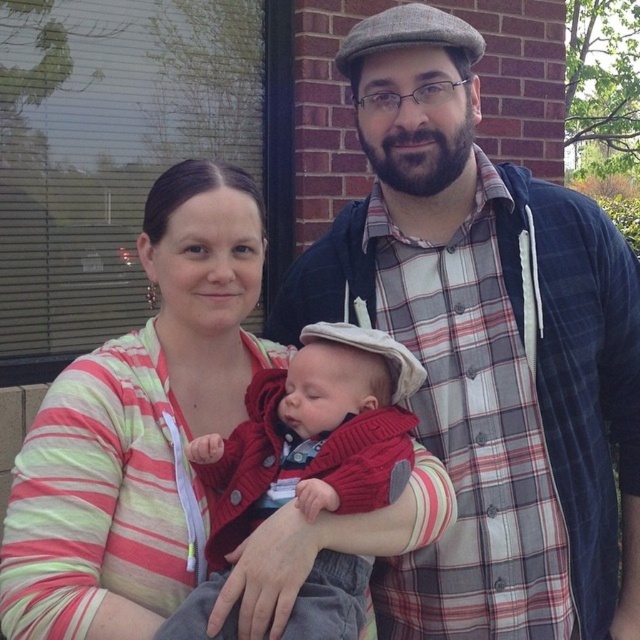
Who is positioned more to the left, plaid shirt at center or knitted red sweater at center?

knitted red sweater at center

Does point (381, 602) come in front of point (244, 520)?

That is False.

This screenshot has width=640, height=640. What do you see at coordinates (486, 348) in the screenshot?
I see `plaid shirt at center` at bounding box center [486, 348].

Where is `plaid shirt at center`? This screenshot has width=640, height=640. plaid shirt at center is located at coordinates (486, 348).

Can you confirm if striped fabric at center is bigger than knitted red sweater at center?

Correct, striped fabric at center is larger in size than knitted red sweater at center.

You are a GUI agent. You are given a task and a screenshot of the screen. Output one action in this format:
    pyautogui.click(x=<x>, y=<y>)
    Task: Click on the striped fabric at center
    The height and width of the screenshot is (640, 640).
    Given the screenshot: What is the action you would take?
    pyautogui.click(x=138, y=426)

Can you confirm if plaid shirt at center is thinner than striped fabric at center?

No, plaid shirt at center is not thinner than striped fabric at center.

Describe the element at coordinates (486, 348) in the screenshot. The width and height of the screenshot is (640, 640). I see `plaid shirt at center` at that location.

Is point (394, 72) positioned after point (326, 538)?

Yes, it is.

This screenshot has height=640, width=640. In order to click on plaid shirt at center in this screenshot , I will do `click(486, 348)`.